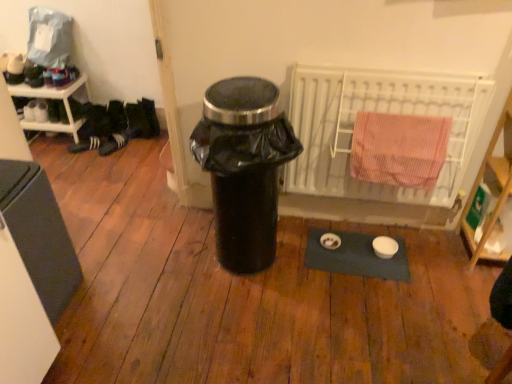
Question: Is white plastic shelf at left, the first shelf when ordered from back to front, shorter than wooden shelf at right, which appears as the 2th shelf when viewed from the top?

Choices:
 (A) no
 (B) yes

Answer: (B)

Question: Is white plastic shelf at left, the first shelf when ordered from back to front, directly adjacent to wooden shelf at right, which ranks as the 1th shelf in right-to-left order?

Choices:
 (A) yes
 (B) no

Answer: (B)

Question: Is white plastic shelf at left, which appears as the 1th shelf when viewed from the left, to the left of wooden shelf at right, the 2th shelf viewed from the back, from the viewer's perspective?

Choices:
 (A) no
 (B) yes

Answer: (B)

Question: From a real-world perspective, is white plastic shelf at left, the second shelf viewed from the right, below wooden shelf at right, which appears as the 2th shelf when viewed from the top?

Choices:
 (A) no
 (B) yes

Answer: (B)

Question: Would you say wooden shelf at right, which appears as the first shelf when viewed from the front, is part of white plastic shelf at left, which appears as the 1th shelf when viewed from the left,'s contents?

Choices:
 (A) yes
 (B) no

Answer: (B)

Question: Is white plastic shelf at left, the first shelf when ordered from back to front, facing towards wooden shelf at right, the first shelf when ordered from bottom to top?

Choices:
 (A) yes
 (B) no

Answer: (B)

Question: Can you confirm if white textured shoe at left, which is the first shoe from right to left, is smaller than black plastic trash can at center?

Choices:
 (A) yes
 (B) no

Answer: (A)

Question: Is white textured shoe at left, which appears as the 2th shoe when viewed from the left, wider than black plastic trash can at center?

Choices:
 (A) yes
 (B) no

Answer: (B)

Question: Is white textured shoe at left, which is the first shoe from right to left, facing away from black plastic trash can at center?

Choices:
 (A) yes
 (B) no

Answer: (B)

Question: Is white textured shoe at left, which appears as the 2th shoe when viewed from the left, thinner than black plastic trash can at center?

Choices:
 (A) no
 (B) yes

Answer: (B)

Question: Is white textured shoe at left, which is the first shoe from right to left, positioned in front of black plastic trash can at center?

Choices:
 (A) yes
 (B) no

Answer: (B)

Question: Would you say white textured shoe at left, which appears as the 2th shoe when viewed from the left, is outside black plastic trash can at center?

Choices:
 (A) yes
 (B) no

Answer: (A)

Question: Does white metal radiator at upper right have a smaller size compared to matte gray refrigerator at left?

Choices:
 (A) no
 (B) yes

Answer: (B)